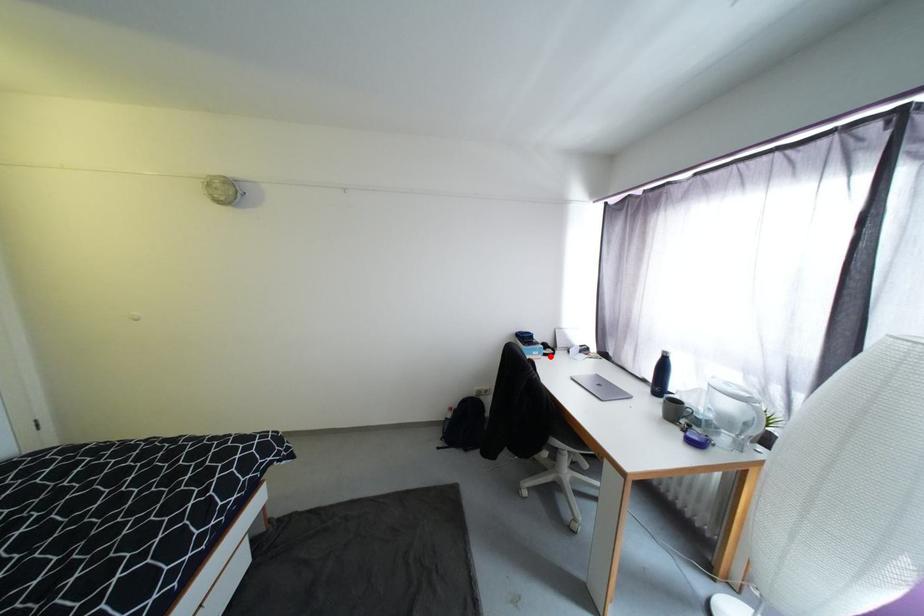
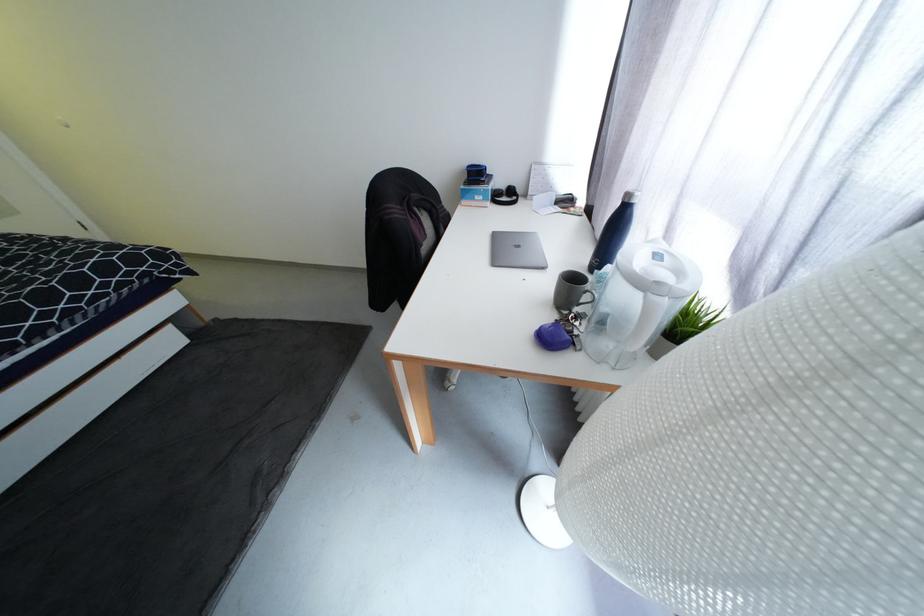
Question: I am providing you with two images of the same scene from different viewpoints. Image1 has a red point marked. In image2, the corresponding 3D location appears at what relative position? Reply with the corresponding letter.

Choices:
 (A) Closer
 (B) Farther

Answer: (A)